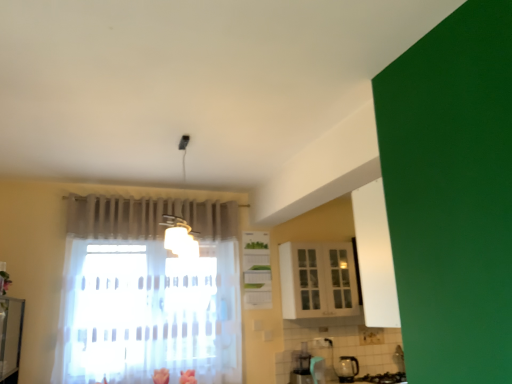
Question: From the image's perspective, is transparent glass kettle at lower right on white glossy cabinet at upper center, acting as the first cabinetry starting from the right?

Choices:
 (A) no
 (B) yes

Answer: (A)

Question: Is transparent glass kettle at lower right positioned beyond the bounds of white glossy cabinet at upper center, acting as the first cabinetry starting from the right?

Choices:
 (A) no
 (B) yes

Answer: (B)

Question: Can you confirm if transparent glass kettle at lower right is wider than white glossy cabinet at upper center, the 2th cabinetry in the left-to-right sequence?

Choices:
 (A) no
 (B) yes

Answer: (A)

Question: Does transparent glass kettle at lower right come in front of white glossy cabinet at upper center, acting as the first cabinetry starting from the right?

Choices:
 (A) yes
 (B) no

Answer: (B)

Question: Considering the relative sizes of transparent glass kettle at lower right and white glossy cabinet at upper center, the 2th cabinetry in the left-to-right sequence, in the image provided, is transparent glass kettle at lower right shorter than white glossy cabinet at upper center, the 2th cabinetry in the left-to-right sequence,?

Choices:
 (A) no
 (B) yes

Answer: (B)

Question: Looking at the image, does transparent glass kettle at lower right seem bigger or smaller compared to white glossy cabinet at upper center, acting as the first cabinetry starting from the right?

Choices:
 (A) big
 (B) small

Answer: (B)

Question: In the image, is transparent glass kettle at lower right on the left side or the right side of white glossy cabinet at upper center, the 2th cabinetry in the left-to-right sequence?

Choices:
 (A) left
 (B) right

Answer: (B)

Question: Considering the positions of transparent glass kettle at lower right and white glossy cabinet at upper center, acting as the first cabinetry starting from the right, in the image, is transparent glass kettle at lower right wider or thinner than white glossy cabinet at upper center, acting as the first cabinetry starting from the right,?

Choices:
 (A) thin
 (B) wide

Answer: (A)

Question: From a real-world perspective, is transparent glass kettle at lower right above or below white glossy cabinet at upper center, acting as the first cabinetry starting from the right?

Choices:
 (A) above
 (B) below

Answer: (B)

Question: Visually, is white glossy cabinet at upper center, acting as the first cabinetry starting from the right, positioned to the left or to the right of transparent glass kettle at lower right?

Choices:
 (A) right
 (B) left

Answer: (B)

Question: Considering the positions of white glossy cabinet at upper center, acting as the first cabinetry starting from the right, and transparent glass kettle at lower right in the image, is white glossy cabinet at upper center, acting as the first cabinetry starting from the right, bigger or smaller than transparent glass kettle at lower right?

Choices:
 (A) small
 (B) big

Answer: (B)

Question: Is point (335, 279) positioned closer to the camera than point (352, 362)?

Choices:
 (A) farther
 (B) closer

Answer: (A)

Question: From the image's perspective, relative to transparent glass kettle at lower right, is white glossy cabinet at upper center, acting as the first cabinetry starting from the right, above or below?

Choices:
 (A) below
 (B) above

Answer: (B)

Question: Considering the positions of white glossy cabinet at center, the 1th cabinetry viewed from the left, and white glossy cabinet at upper center, acting as the first cabinetry starting from the right, in the image, is white glossy cabinet at center, the 1th cabinetry viewed from the left, wider or thinner than white glossy cabinet at upper center, acting as the first cabinetry starting from the right,?

Choices:
 (A) wide
 (B) thin

Answer: (B)

Question: Does point (260, 241) appear closer or farther from the camera than point (313, 269)?

Choices:
 (A) farther
 (B) closer

Answer: (A)